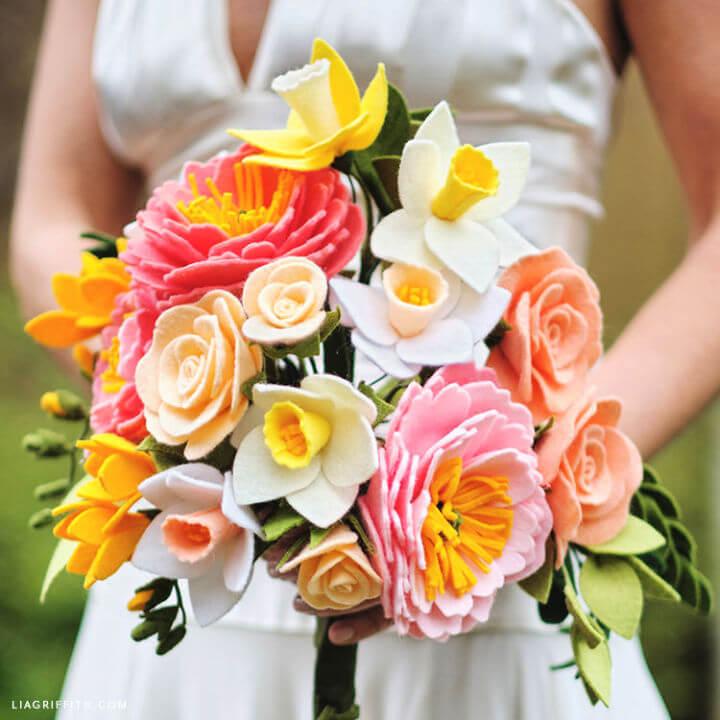
This screenshot has width=720, height=720. Identify the location of fake flowers. (355, 454).